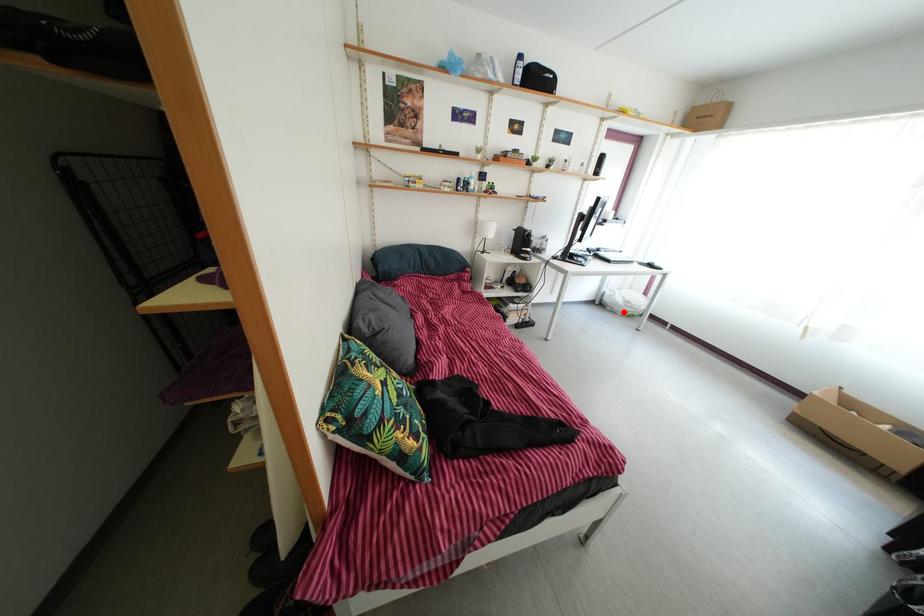
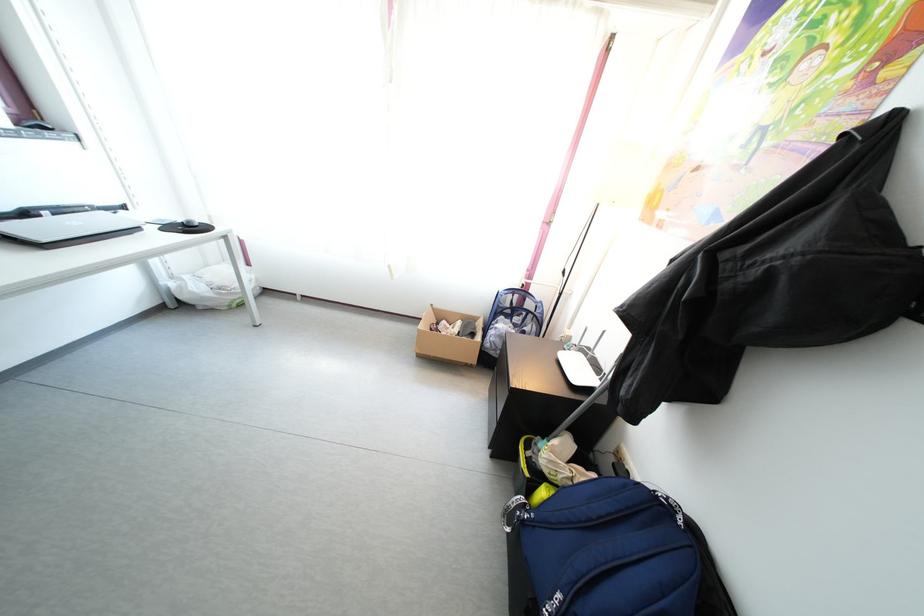
Question: I am providing you with two images of the same scene from different viewpoints. In image1, a red point is highlighted. Considering the same 3D point in image2, which of the following is correct?

Choices:
 (A) It is closer
 (B) It is farther

Answer: (B)